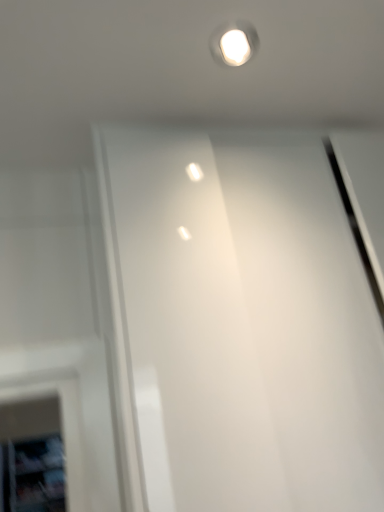
Locate an element on the screen. white glossy droplight at upper center is located at coordinates (234, 44).

The width and height of the screenshot is (384, 512). What do you see at coordinates (234, 44) in the screenshot?
I see `white glossy droplight at upper center` at bounding box center [234, 44].

This screenshot has height=512, width=384. I want to click on white glossy droplight at upper center, so click(234, 44).